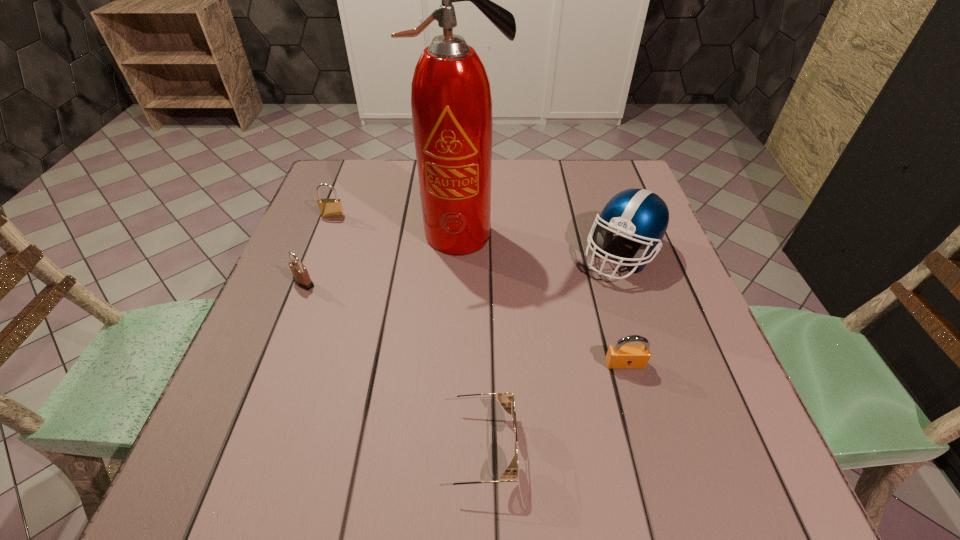
In the image, there is a desktop. Where is `vacant space at the right edge`? This screenshot has width=960, height=540. vacant space at the right edge is located at coordinates (704, 399).

This screenshot has height=540, width=960. Find the location of `free space at the far left corner of the desktop`. free space at the far left corner of the desktop is located at coordinates (367, 183).

The width and height of the screenshot is (960, 540). In the image, there is a desktop. Identify the location of vacant space at the near right corner. (771, 494).

This screenshot has height=540, width=960. I want to click on empty space that is in between the second tallest object and the second farthest padlock, so pyautogui.click(x=463, y=269).

The width and height of the screenshot is (960, 540). I want to click on blank region between the farthest padlock and the shortest object, so click(404, 332).

Identify the location of vacant space that is in between the farthest padlock and the fire extinguisher. The width and height of the screenshot is (960, 540). (398, 225).

Locate an element on the screen. vacant space that's between the farthest padlock and the second farthest padlock is located at coordinates (319, 249).

The image size is (960, 540). I want to click on unoccupied position between the farthest padlock and the fire extinguisher, so click(398, 225).

What are the coordinates of `blank region between the farthest padlock and the second farthest padlock` in the screenshot? It's located at (319, 249).

The image size is (960, 540). What are the coordinates of `empty space that is in between the second nearest padlock and the second tallest object` in the screenshot? It's located at (463, 269).